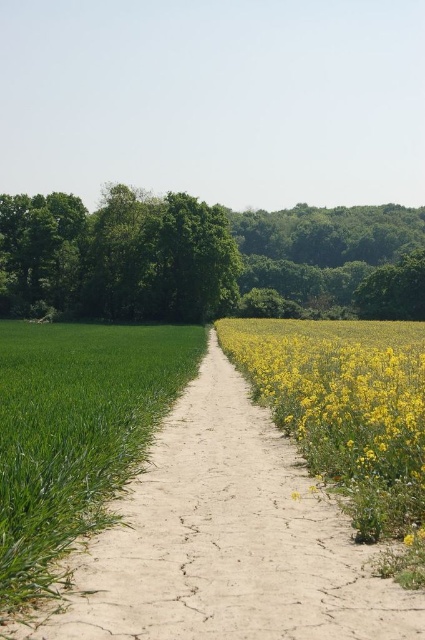
You are standing at the edge of the green grass at left and want to walk to the dusty brown dirt track at center. Is the path directly in front of you or behind you?

The dusty brown dirt track at center is closer to the viewer than the green grass at left, so the path is directly in front of you.

You are standing at the edge of the green grass at left and want to walk to the dusty brown dirt track at center. Which surface will feel higher under your feet?

The green grass at left is higher than the dusty brown dirt track at center, so when you step from the grass onto the dirt track, the track will feel lower under your feet compared to the grass.